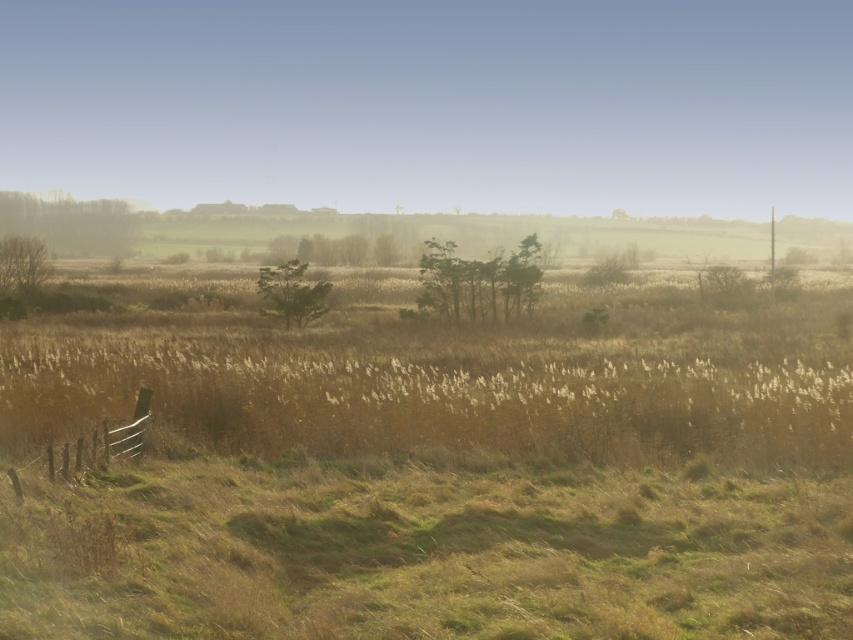
Between brown wooden fence at lower left and green matte tree at center, which one has more height?

Standing taller between the two is green matte tree at center.

Can you confirm if brown wooden fence at lower left is positioned below green matte tree at center?

Correct, brown wooden fence at lower left is located below green matte tree at center.

Between point (138, 438) and point (303, 284), which one is positioned in front?

Positioned in front is point (138, 438).

Identify the location of brown wooden fence at lower left. (120, 435).

Can you confirm if brown wooden fence at lower left is positioned above bare branches at left?

Actually, brown wooden fence at lower left is below bare branches at left.

The width and height of the screenshot is (853, 640). What do you see at coordinates (120, 435) in the screenshot?
I see `brown wooden fence at lower left` at bounding box center [120, 435].

The height and width of the screenshot is (640, 853). Identify the location of brown wooden fence at lower left. (120, 435).

Measure the distance from green matte trees at center to green matte tree at center.

A distance of 5.00 meters exists between green matte trees at center and green matte tree at center.

Who is lower down, green matte trees at center or green matte tree at center?

green matte tree at center is below.

What do you see at coordinates (479, 282) in the screenshot?
I see `green matte trees at center` at bounding box center [479, 282].

At what (x,y) coordinates should I click in order to perform the action: click on green matte trees at center. Please return your answer as a coordinate pair (x, y). The height and width of the screenshot is (640, 853). Looking at the image, I should click on (479, 282).